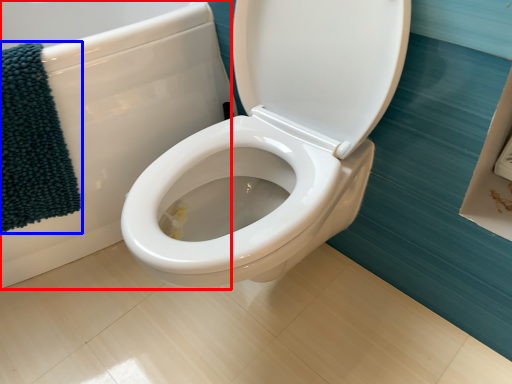
Question: Which object is further to the camera taking this photo, bath (highlighted by a red box) or bath towel (highlighted by a blue box)?

Choices:
 (A) bath
 (B) bath towel

Answer: (B)